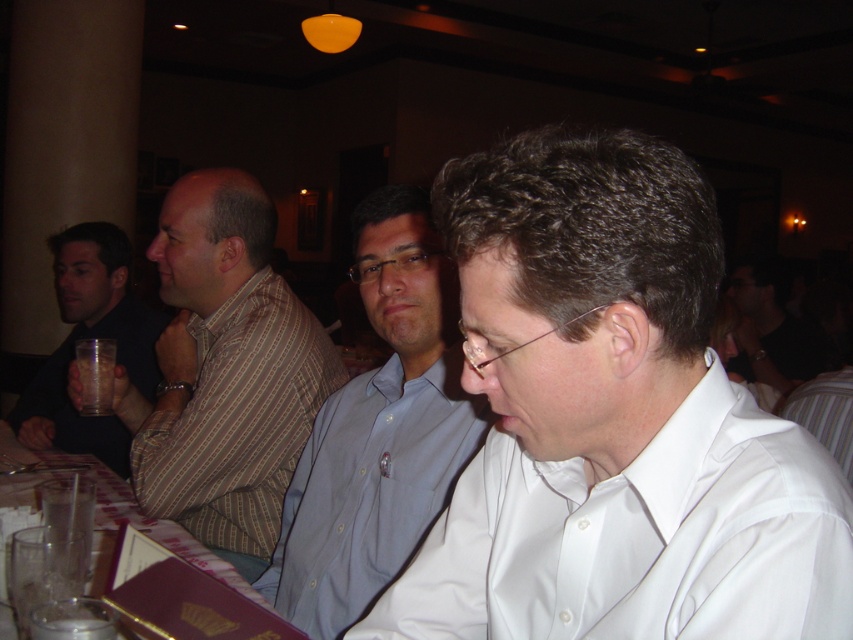
Based on the scene description, can you determine if the striped cotton shirt at left is positioned higher than the clear plastic cup at left?

Yes, the striped cotton shirt at left is positioned higher than the clear plastic cup at left because the striped cotton shirt at left is above clear plastic cup at left.